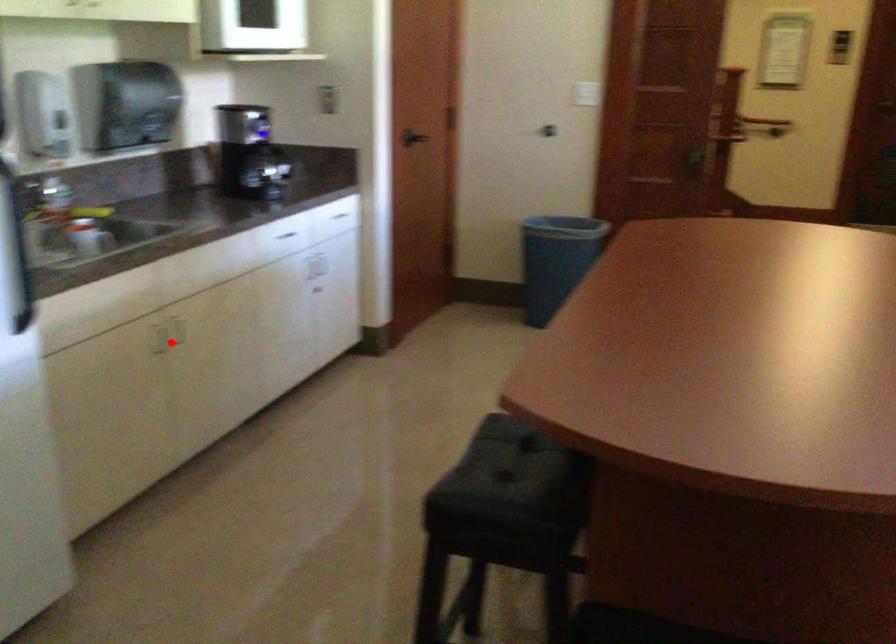
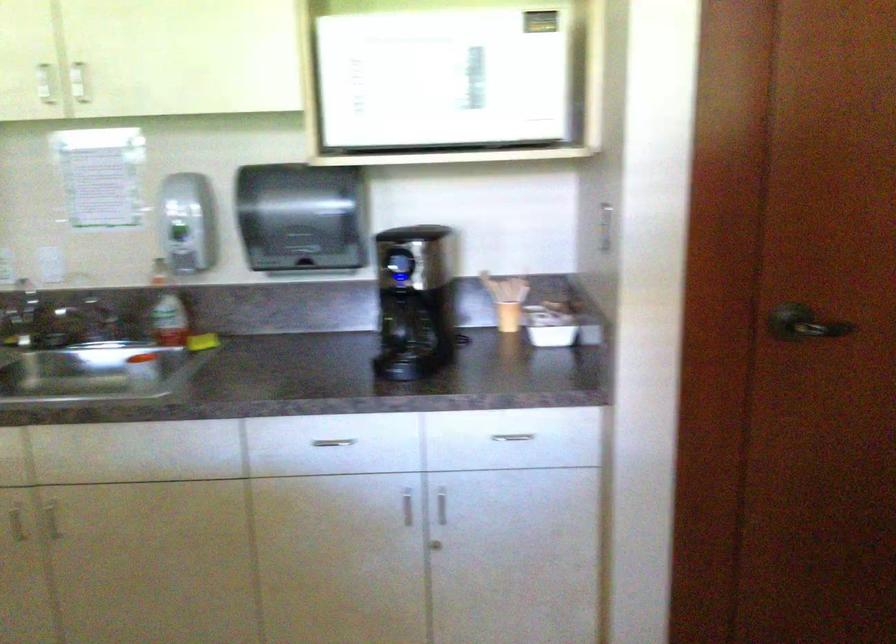
Question: I am providing you with two images of the same scene from different viewpoints. Given a red point in image1, look at the same physical point in image2. Is it:

Choices:
 (A) Closer to the viewpoint
 (B) Farther from the viewpoint

Answer: (A)